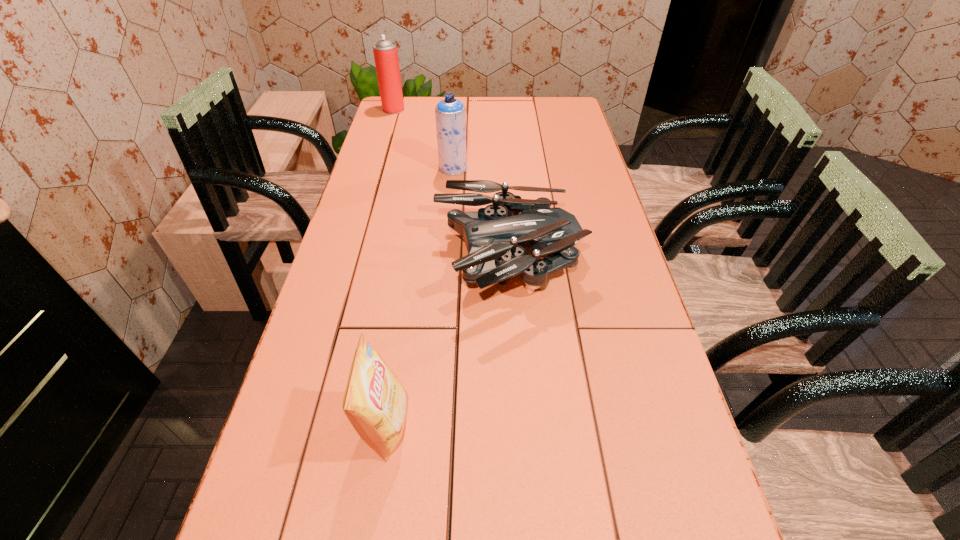
The height and width of the screenshot is (540, 960). In order to click on vacant space that satisfies the following two spatial constraints: 1. on the front side of the shortest object; 2. on the left side of the farthest object in this screenshot , I will do `click(348, 263)`.

Locate an element on the screen. This screenshot has height=540, width=960. free point that satisfies the following two spatial constraints: 1. on the front side of the right aerosol can; 2. on the right side of the left aerosol can is located at coordinates (376, 167).